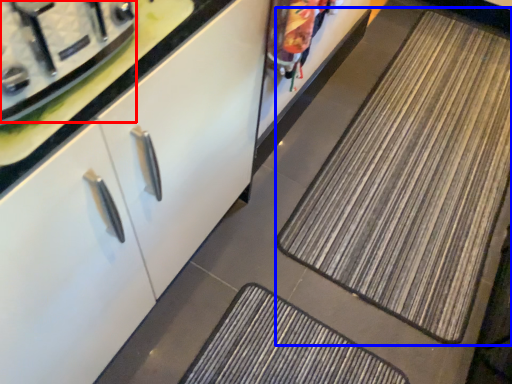
Question: Which point is closer to the camera, appliance (highlighted by a red box) or mat (highlighted by a blue box)?

Choices:
 (A) appliance
 (B) mat

Answer: (A)